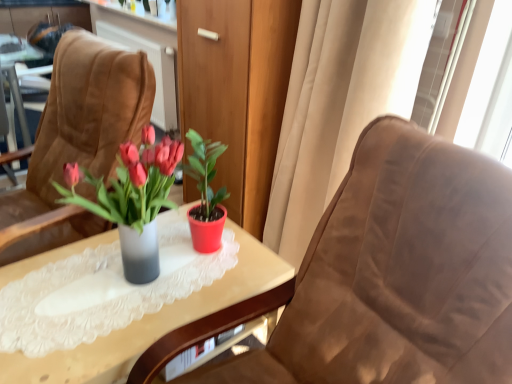
Where is `suede chair at center, which ranks as the 2th chair in left-to-right order`? Image resolution: width=512 pixels, height=384 pixels. suede chair at center, which ranks as the 2th chair in left-to-right order is located at coordinates (385, 278).

Identify the location of matte plastic vase at center. (133, 199).

Does translucent glass vase at center contain matte plastic vase at center?

No, matte plastic vase at center is not surrounded by translucent glass vase at center.

Who is bigger, translucent glass vase at center or matte plastic vase at center?

translucent glass vase at center is bigger.

Is translucent glass vase at center oriented away from matte plastic vase at center?

translucent glass vase at center is not turned away from matte plastic vase at center.

Considering the positions of objects translucent glass vase at center and matte plastic vase at center in the image provided, who is more to the right, translucent glass vase at center or matte plastic vase at center?

Positioned to the right is matte plastic vase at center.

From the image's perspective, who appears lower, matte plastic vase at center or beige fabric curtain at right?

matte plastic vase at center, from the image's perspective.

Can you tell me how much matte plastic vase at center and beige fabric curtain at right differ in facing direction?

There is a 1.71-degree angle between the facing directions of matte plastic vase at center and beige fabric curtain at right.

Considering the relative sizes of matte plastic vase at center and beige fabric curtain at right in the image provided, is matte plastic vase at center taller than beige fabric curtain at right?

Incorrect, the height of matte plastic vase at center is not larger of that of beige fabric curtain at right.

From a real-world perspective, which is physically above, matte plastic vase at center or beige fabric curtain at right?

matte plastic vase at center is physically above.

How different are the orientations of matte plastic vase at center and suede chair at left, the second chair in the right-to-left sequence, in degrees?

The angular difference between matte plastic vase at center and suede chair at left, the second chair in the right-to-left sequence, is 9.83 degrees.

You are a GUI agent. You are given a task and a screenshot of the screen. Output one action in this format:
    pyautogui.click(x=<x>, y=<y>)
    Task: Click on the chair above the matte plastic vase at center (from the image's perspective)
    
    Given the screenshot: What is the action you would take?
    pyautogui.click(x=77, y=139)

Considering the relative positions of matte plastic vase at center and suede chair at left, the second chair in the right-to-left sequence, in the image provided, is matte plastic vase at center to the right of suede chair at left, the second chair in the right-to-left sequence, from the viewer's perspective?

Indeed, matte plastic vase at center is positioned on the right side of suede chair at left, the second chair in the right-to-left sequence.

Considering the relative sizes of matte plastic vase at center and suede chair at left, the second chair in the right-to-left sequence, in the image provided, is matte plastic vase at center wider than suede chair at left, the second chair in the right-to-left sequence,?

No.

Considering the points (106, 181) and (147, 204), which point is in front, point (106, 181) or point (147, 204)?

The point (106, 181) is closer.

Is suede chair at left, the second chair in the right-to-left sequence, aimed at matte plastic vase at center?

No.

Between suede chair at left, placed as the first chair when sorted from left to right, and matte plastic vase at center, which one appears on the left side from the viewer's perspective?

suede chair at left, placed as the first chair when sorted from left to right, is more to the left.

Considering the sizes of objects suede chair at left, placed as the first chair when sorted from left to right, and matte plastic vase at center in the image provided, who is taller, suede chair at left, placed as the first chair when sorted from left to right, or matte plastic vase at center?

suede chair at left, placed as the first chair when sorted from left to right.

Does point (419, 268) come farther from viewer compared to point (136, 340)?

No, (419, 268) is closer to viewer.

Considering the sizes of suede chair at center, the first chair when ordered from right to left, and translucent glass vase at center in the image, is suede chair at center, the first chair when ordered from right to left, wider or thinner than translucent glass vase at center?

In the image, suede chair at center, the first chair when ordered from right to left, appears to be wider than translucent glass vase at center.

From the image's perspective, is suede chair at center, the first chair when ordered from right to left, on translucent glass vase at center?

Yes, from the image's perspective, suede chair at center, the first chair when ordered from right to left, is over translucent glass vase at center.

Based on the photo, is suede chair at center, which ranks as the 2th chair in left-to-right order, facing away from translucent glass vase at center?

No, suede chair at center, which ranks as the 2th chair in left-to-right order, is not facing away from translucent glass vase at center.

Measure the distance between suede chair at center, which ranks as the 2th chair in left-to-right order, and suede chair at left, placed as the first chair when sorted from left to right.

They are 36.23 inches apart.

Is the depth of suede chair at center, the first chair when ordered from right to left, less than that of suede chair at left, placed as the first chair when sorted from left to right?

That is True.

Considering the relative positions of suede chair at center, which ranks as the 2th chair in left-to-right order, and suede chair at left, the second chair in the right-to-left sequence, in the image provided, is suede chair at center, which ranks as the 2th chair in left-to-right order, to the left or to the right of suede chair at left, the second chair in the right-to-left sequence,?

From the image, it's evident that suede chair at center, which ranks as the 2th chair in left-to-right order, is to the right of suede chair at left, the second chair in the right-to-left sequence.

Is suede chair at center, the first chair when ordered from right to left, far from suede chair at left, the second chair in the right-to-left sequence?

They are positioned close to each other.

Can you confirm if suede chair at left, the second chair in the right-to-left sequence, is bigger than suede chair at center, which ranks as the 2th chair in left-to-right order?

Actually, suede chair at left, the second chair in the right-to-left sequence, might be smaller than suede chair at center, which ranks as the 2th chair in left-to-right order.

Based on the photo, from a real-world perspective, is suede chair at left, the second chair in the right-to-left sequence, positioned above or below suede chair at center, which ranks as the 2th chair in left-to-right order?

suede chair at left, the second chair in the right-to-left sequence, is situated higher than suede chair at center, which ranks as the 2th chair in left-to-right order, in the real world.

Between suede chair at left, placed as the first chair when sorted from left to right, and suede chair at center, the first chair when ordered from right to left, which one appears on the left side from the viewer's perspective?

suede chair at left, placed as the first chair when sorted from left to right.

Does suede chair at left, the second chair in the right-to-left sequence, have a lesser height compared to suede chair at center, the first chair when ordered from right to left?

No, suede chair at left, the second chair in the right-to-left sequence, is not shorter than suede chair at center, the first chair when ordered from right to left.

Locate an element on the screen. This screenshot has width=512, height=384. table in front of the matte plastic vase at center is located at coordinates (154, 321).

Where is `houseplant on the left of beige fabric curtain at right`? houseplant on the left of beige fabric curtain at right is located at coordinates (133, 199).

In the scene shown: From the image, which object appears to be nearer to suede chair at left, placed as the first chair when sorted from left to right, matte plastic vase at center or translucent glass vase at center?

matte plastic vase at center is positioned closer to the anchor suede chair at left, placed as the first chair when sorted from left to right.

From the image, which object appears to be farther from matte plastic vase at center, beige fabric curtain at right or translucent glass vase at center?

→ Based on the image, beige fabric curtain at right appears to be further to matte plastic vase at center.

Estimate the real-world distances between objects in this image. Which object is further from beige fabric curtain at right, matte plastic vase at center or suede chair at left, the second chair in the right-to-left sequence?

Among the two, suede chair at left, the second chair in the right-to-left sequence, is located further to beige fabric curtain at right.

Estimate the real-world distances between objects in this image. Which object is further from matte plastic vase at center, translucent glass vase at center or suede chair at left, the second chair in the right-to-left sequence?

suede chair at left, the second chair in the right-to-left sequence, lies further to matte plastic vase at center than the other object.

Which object lies nearer to the anchor point suede chair at center, the first chair when ordered from right to left, beige fabric curtain at right or matte plastic vase at center?

Based on the image, matte plastic vase at center appears to be nearer to suede chair at center, the first chair when ordered from right to left.

Which object lies further to the anchor point matte plastic vase at center, translucent glass vase at center or suede chair at center, the first chair when ordered from right to left?

Based on the image, suede chair at center, the first chair when ordered from right to left, appears to be further to matte plastic vase at center.

From the image, which object appears to be nearer to suede chair at center, which ranks as the 2th chair in left-to-right order, translucent glass vase at center or suede chair at left, the second chair in the right-to-left sequence?

translucent glass vase at center.

Which object lies further to the anchor point translucent glass vase at center, matte plastic vase at center or suede chair at center, the first chair when ordered from right to left?

suede chair at center, the first chair when ordered from right to left, lies further to translucent glass vase at center than the other object.

Where is `chair situated between suede chair at left, placed as the first chair when sorted from left to right, and beige fabric curtain at right from left to right`? The image size is (512, 384). chair situated between suede chair at left, placed as the first chair when sorted from left to right, and beige fabric curtain at right from left to right is located at coordinates (385, 278).

Find the location of a particular element. table located between suede chair at center, which ranks as the 2th chair in left-to-right order, and beige fabric curtain at right in the depth direction is located at coordinates (154, 321).

You are a GUI agent. You are given a task and a screenshot of the screen. Output one action in this format:
    pyautogui.click(x=<x>, y=<y>)
    Task: Click on the houseplant between suede chair at center, which ranks as the 2th chair in left-to-right order, and beige fabric curtain at right, along the z-axis
    Image resolution: width=512 pixels, height=384 pixels.
    Given the screenshot: What is the action you would take?
    pyautogui.click(x=133, y=199)

Identify the location of table between suede chair at left, placed as the first chair when sorted from left to right, and beige fabric curtain at right, in the horizontal direction. This screenshot has width=512, height=384. (154, 321).